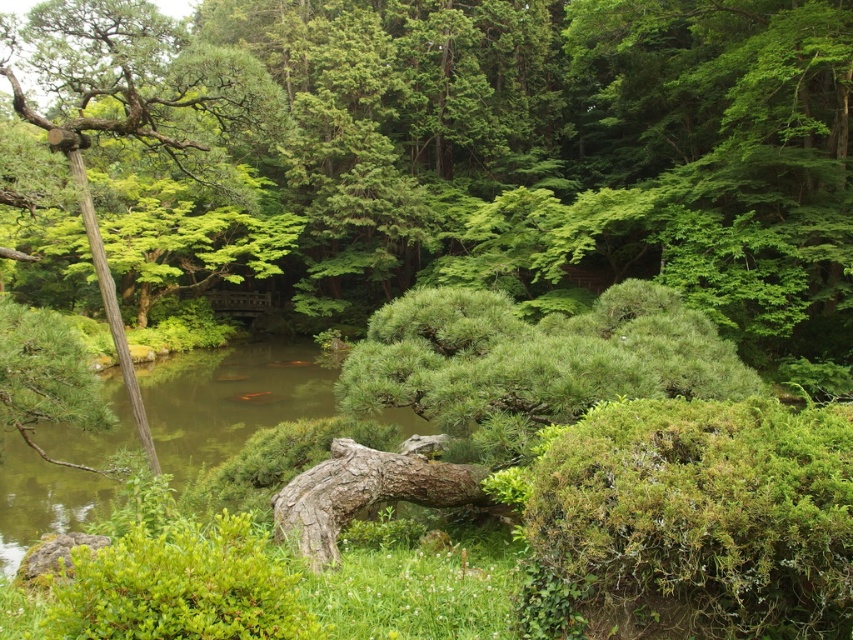
Is the position of green mossy bush at lower right more distant than that of green leafy tree at left?

No.

In the scene shown: Which is more to the left, green mossy bush at lower right or green leafy tree at left?

green leafy tree at left is more to the left.

Who is more forward, (x=540, y=538) or (x=260, y=120)?

Point (x=540, y=538) is in front.

Locate an element on the screen. The width and height of the screenshot is (853, 640). green mossy bush at lower right is located at coordinates (703, 513).